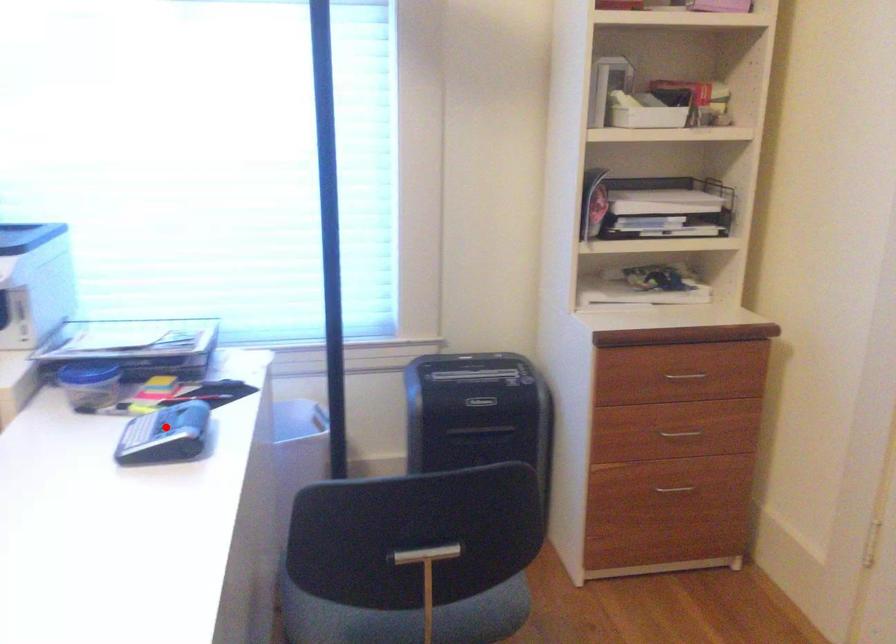
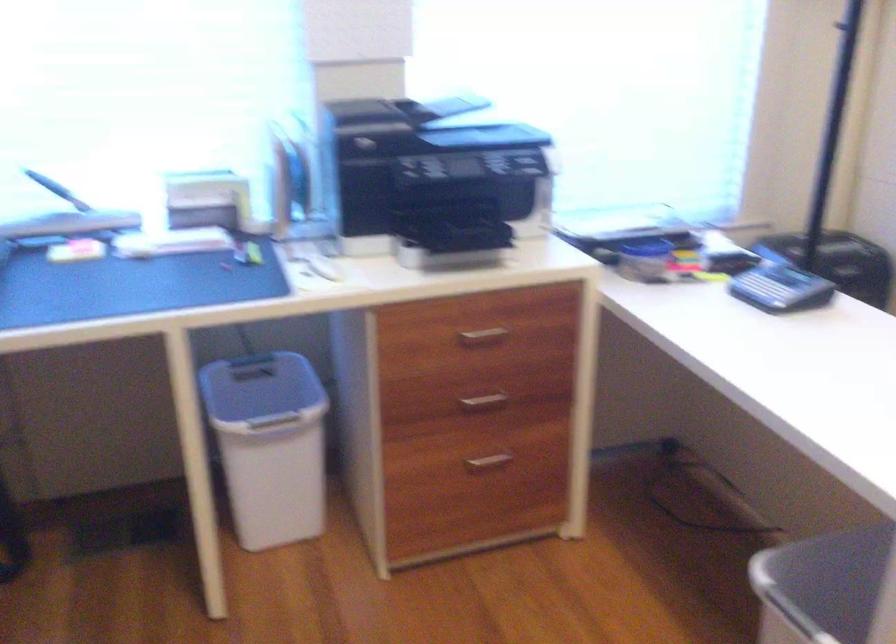
Question: I am providing you with two images of the same scene from different viewpoints. Image1 has a red point marked. In image2, the corresponding 3D location appears at what relative position? Reply with the corresponding letter.

Choices:
 (A) Closer
 (B) Farther

Answer: (B)